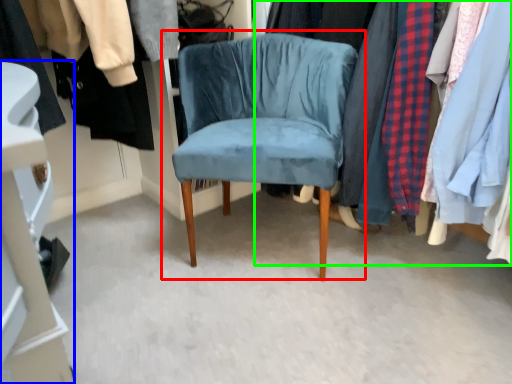
Question: Based on their relative distances, which object is farther from chair (highlighted by a red box)? Choose from closet (highlighted by a blue box) and closet (highlighted by a green box).

Choices:
 (A) closet
 (B) closet

Answer: (A)